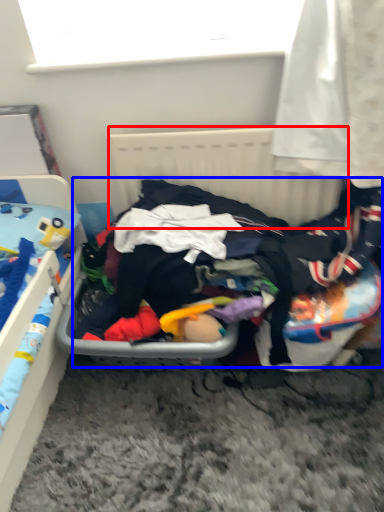
Question: Which object is closer to the camera taking this photo, radiator (highlighted by a red box) or clothing (highlighted by a blue box)?

Choices:
 (A) radiator
 (B) clothing

Answer: (B)